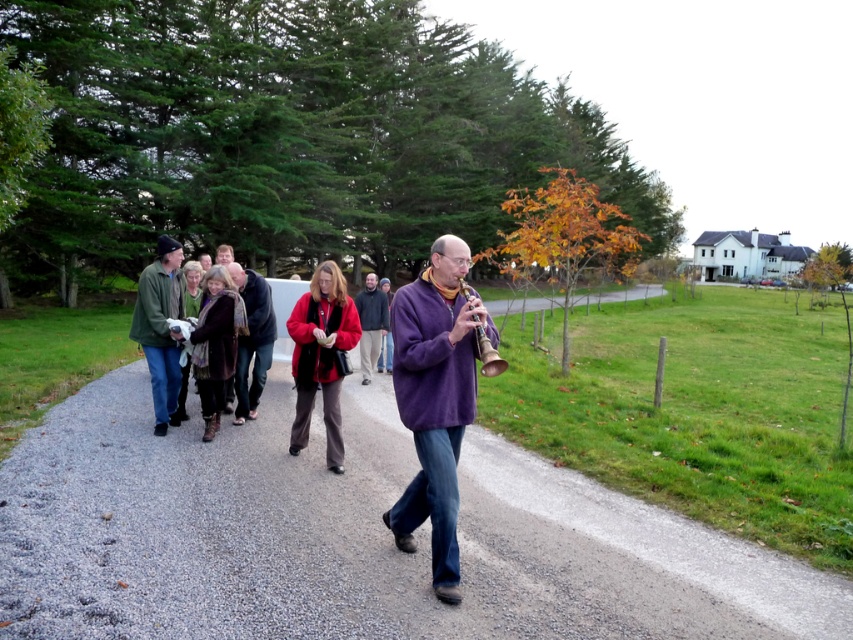
You are a fashion designer observing the two sweaters in the scene. Which sweater is taller when comparing the purple soft sweater at center and the red wool sweater at center?

The purple soft sweater at center is taller than the red wool sweater at center.

You are a photographer trying to capture the purple soft sweater at center in your shot. What are the coordinates where you should focus your camera?

The coordinates to focus on are point (434, 400).